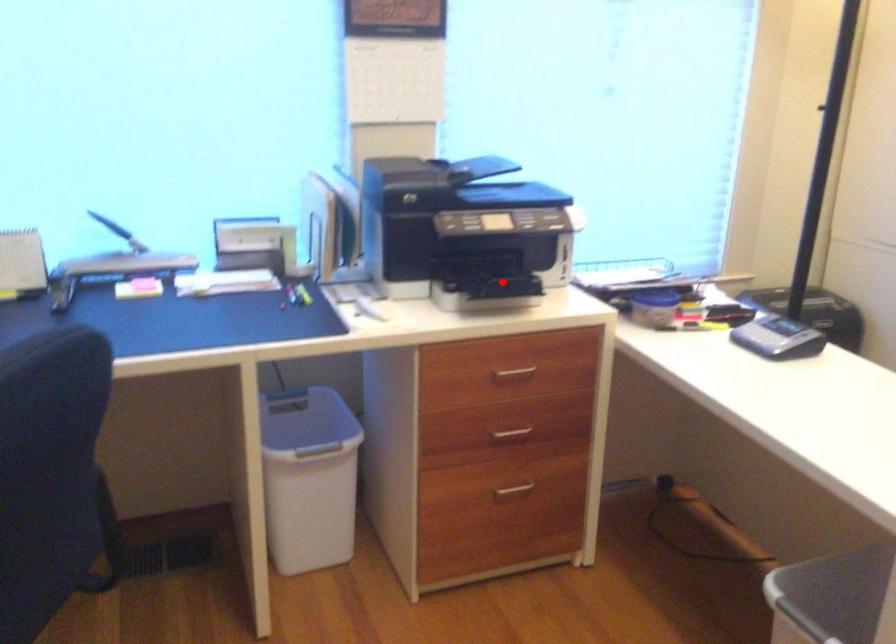
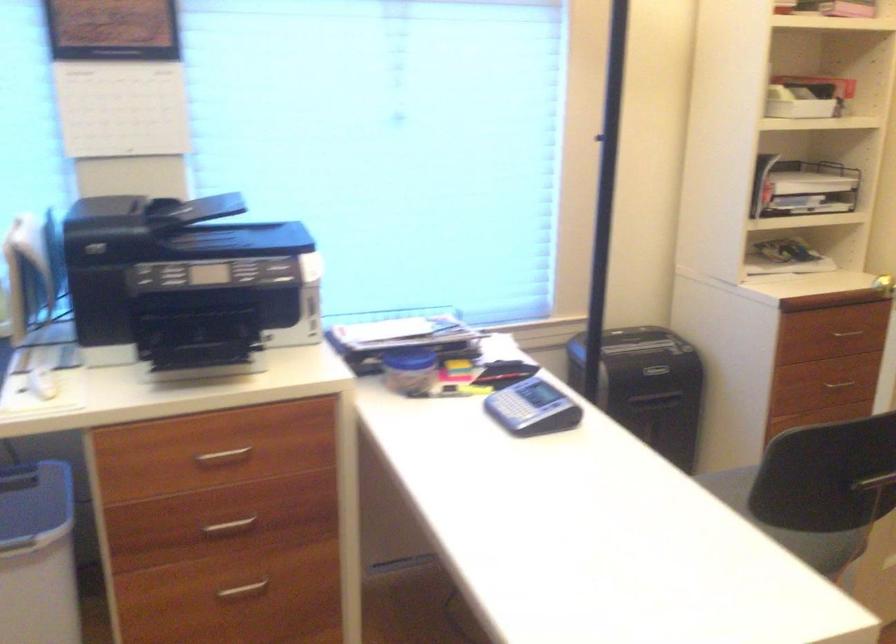
Question: I am providing you with two images of the same scene from different viewpoints. A red point is shown in image1. For the corresponding object point in image2, is it positioned nearer or farther from the camera?

Choices:
 (A) Nearer
 (B) Farther

Answer: (A)